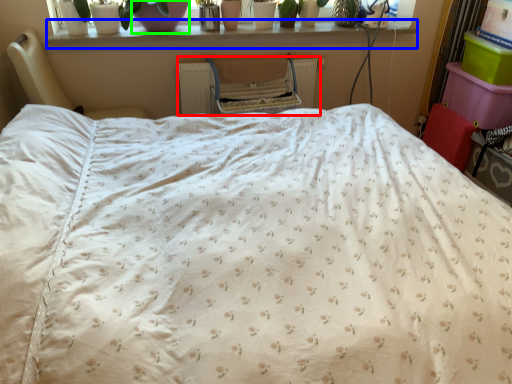
Question: Based on their relative distances, which object is farther from radiator (highlighted by a red box)? Choose from window sill (highlighted by a blue box) and glass vase (highlighted by a green box).

Choices:
 (A) window sill
 (B) glass vase

Answer: (B)